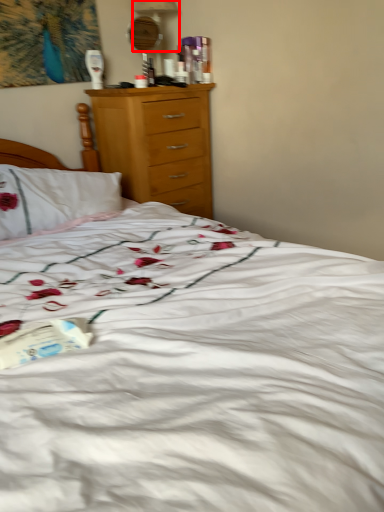
Question: From the image's perspective, what is the correct spatial positioning of table lamp (annotated by the red box) in reference to paperback book?

Choices:
 (A) above
 (B) below

Answer: (A)